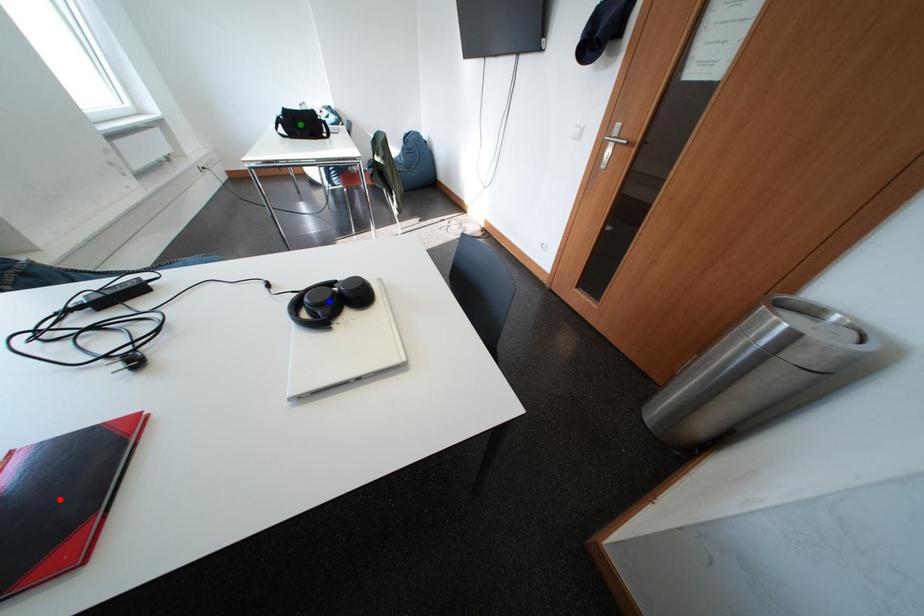
Order these from nearest to farthest:
green point, blue point, red point

green point < blue point < red point